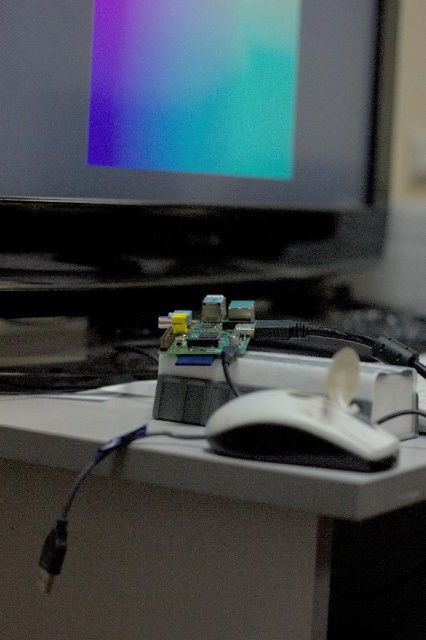
You are organizing your desk and want to place a new keyboard between the white matte table at center and the white matte mouse at center. Based on their positions, which object should the keyboard be placed closer to?

The white matte mouse at center is to the right of the white matte table at center, so the keyboard should be placed closer to the white matte mouse at center to be between them.

You are organizing a workspace and need to place both the white matte table at center and the white matte mouse at center. Since both are at the center, which one takes up more space?

The white matte table at center is bigger than the white matte mouse at center, so it takes up more space.

You are setting up a computer desk and need to place a new keyboard between the matte black monitor at upper center and the white matte mouse at center. According to their positions, which side should the keyboard be placed on to be between them?

The keyboard should be placed to the right of the matte black monitor at upper center since it is to the left of the white matte mouse at center.